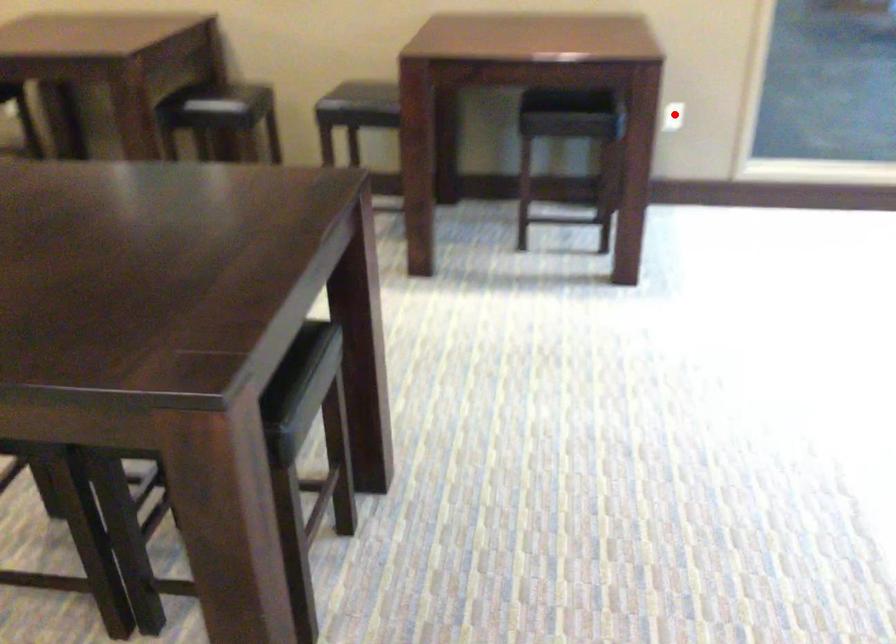
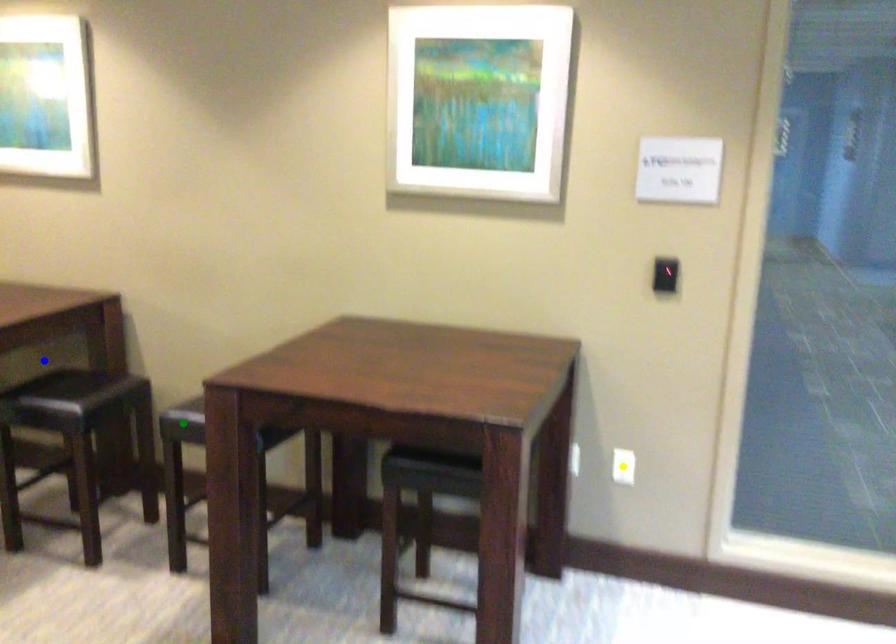
Question: I am providing you with two images of the same scene from different viewpoints. A red point is marked on the first image. You are given multiple points on the second image. In image 2, which mark is for the same physical point as the one in image 1?

Choices:
 (A) blue point
 (B) yellow point
 (C) green point

Answer: (B)